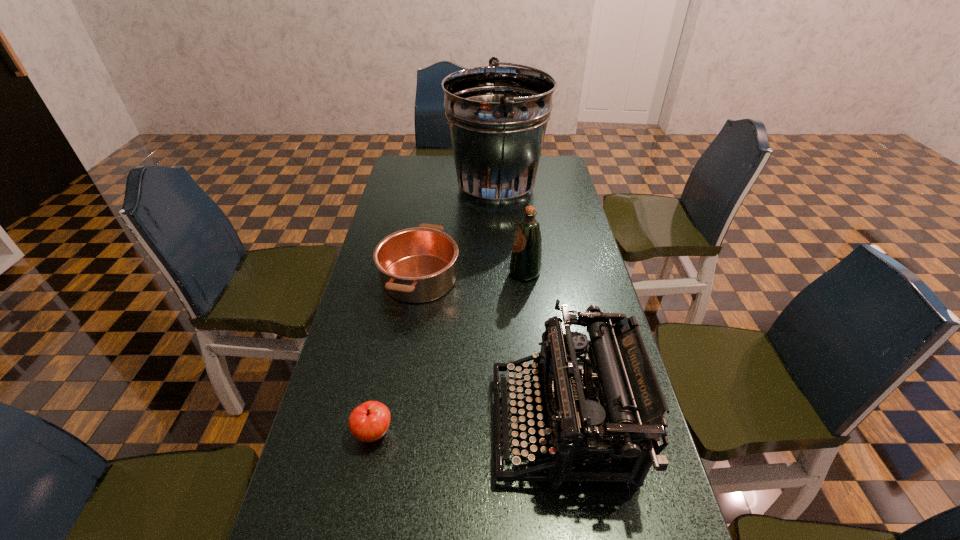
This screenshot has height=540, width=960. Find the location of `vacant space in between the apple and the typewriter`. vacant space in between the apple and the typewriter is located at coordinates [x=468, y=428].

Locate an element on the screen. This screenshot has width=960, height=540. unoccupied area between the saucepan and the olive oil is located at coordinates (472, 275).

The image size is (960, 540). I want to click on free area in between the saucepan and the olive oil, so click(x=472, y=275).

You are a GUI agent. You are given a task and a screenshot of the screen. Output one action in this format:
    pyautogui.click(x=<x>, y=<y>)
    Task: Click on the second closest object to the apple
    
    Given the screenshot: What is the action you would take?
    pyautogui.click(x=416, y=265)

Find the location of a particular element. object that ranks as the second closest to the typewriter is located at coordinates (368, 422).

Where is `vacant point that satisfies the following two spatial constraints: 1. on the back side of the apple; 2. on the left side of the tallest object`? The height and width of the screenshot is (540, 960). vacant point that satisfies the following two spatial constraints: 1. on the back side of the apple; 2. on the left side of the tallest object is located at coordinates (421, 188).

At what (x,y) coordinates should I click in order to perform the action: click on free space that satisfies the following two spatial constraints: 1. on the front-facing side of the olive oil; 2. on the front side of the apple. Please return your answer as a coordinate pair (x, y). The image size is (960, 540). Looking at the image, I should click on (544, 433).